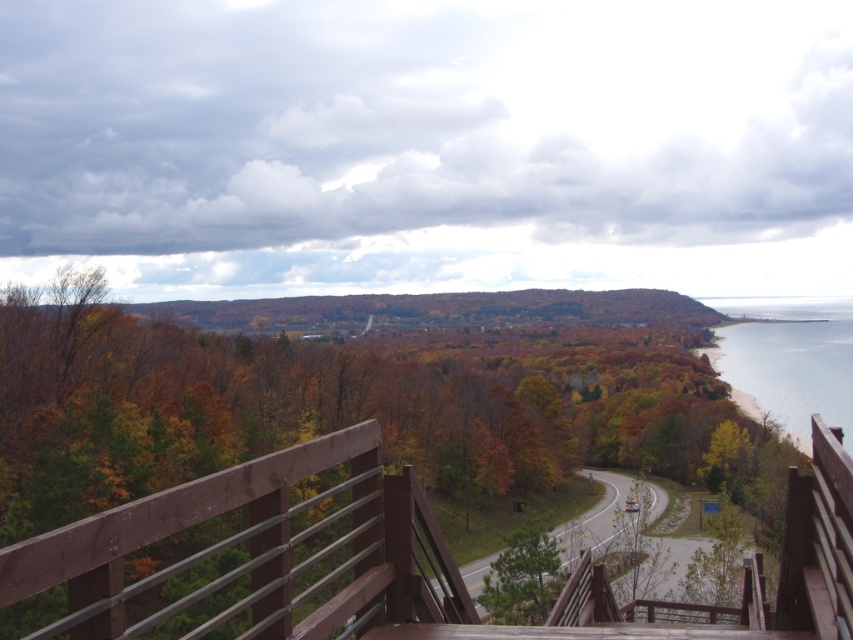
Does brown wooden deck at center appear on the right side of clear blue water at lower right?

No, brown wooden deck at center is not to the right of clear blue water at lower right.

Which is behind, point (814, 548) or point (837, 308)?

The point (837, 308) is more distant.

Is point (256, 538) positioned behind point (809, 326)?

That is False.

You are a GUI agent. You are given a task and a screenshot of the screen. Output one action in this format:
    pyautogui.click(x=<x>, y=<y>)
    Task: Click on the brown wooden deck at center
    
    Given the screenshot: What is the action you would take?
    pyautogui.click(x=405, y=557)